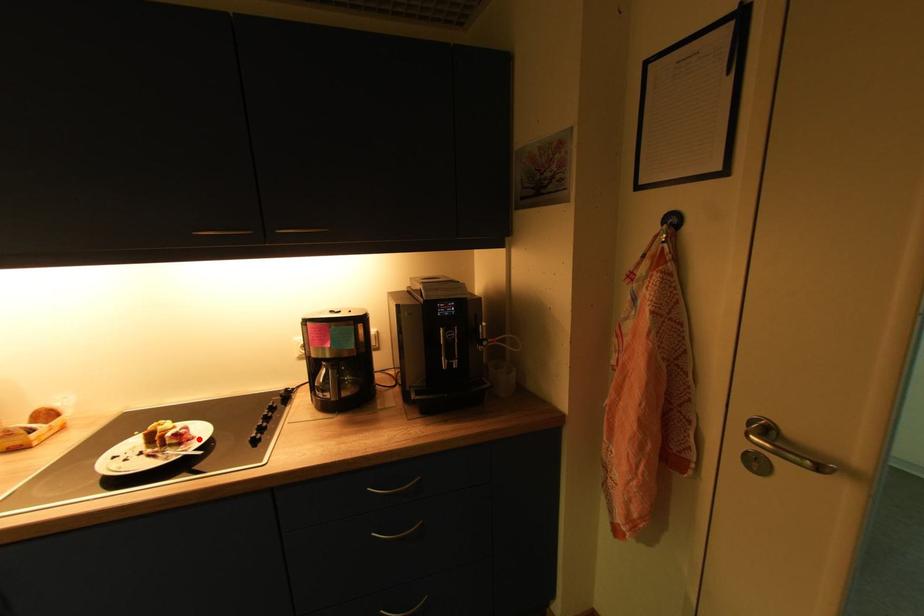
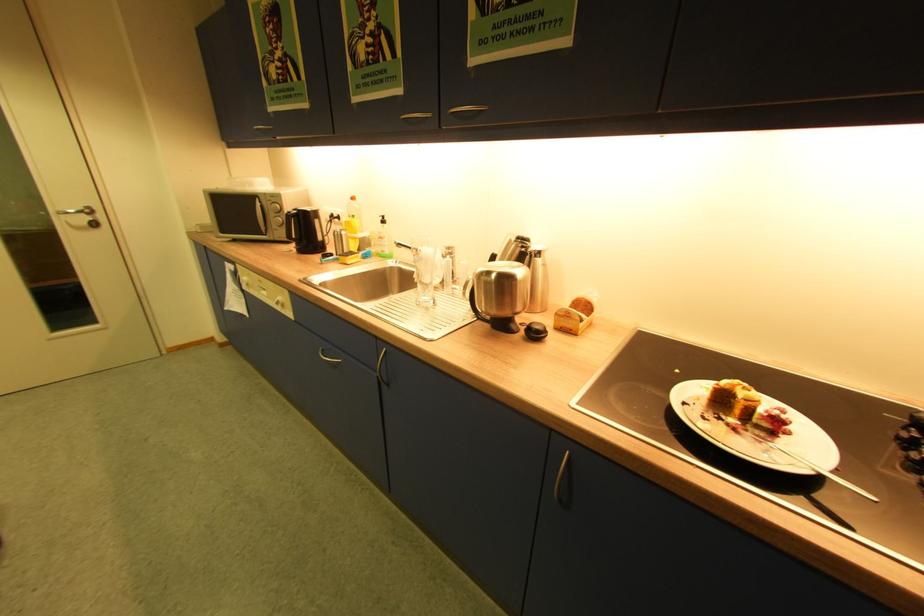
Where in the second image is the point corresponding to the highlighted location from the first image?

(794, 434)